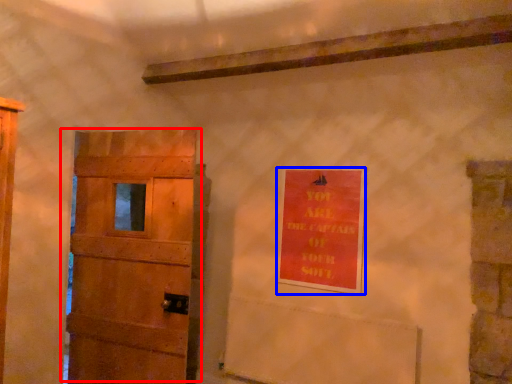
Question: Which point is further to the camera, door (highlighted by a red box) or warning sign (highlighted by a blue box)?

Choices:
 (A) door
 (B) warning sign

Answer: (B)